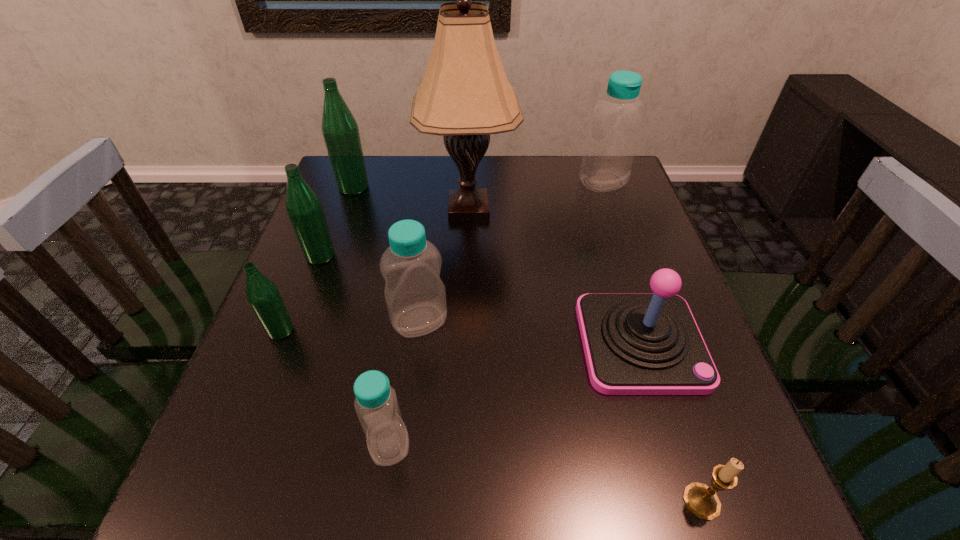
Locate an element on the screen. The height and width of the screenshot is (540, 960). vacant space positioned 0.060m on the right of the smallest green bottle is located at coordinates (324, 330).

Where is `vacant space situated on the left of the second nearest object`? vacant space situated on the left of the second nearest object is located at coordinates (282, 443).

You are a GUI agent. You are given a task and a screenshot of the screen. Output one action in this format:
    pyautogui.click(x=<x>, y=<y>)
    Task: Click on the free space located 0.400m on the back of the nearest object
    The height and width of the screenshot is (540, 960).
    Given the screenshot: What is the action you would take?
    pyautogui.click(x=632, y=293)

Where is `lamp located at the far edge`? This screenshot has width=960, height=540. lamp located at the far edge is located at coordinates (465, 96).

Image resolution: width=960 pixels, height=540 pixels. I want to click on bottle situated at the near edge, so click(376, 404).

You are a GUI agent. You are given a task and a screenshot of the screen. Output one action in this format:
    pyautogui.click(x=<x>, y=<y>)
    Task: Click on the candle holder at the near edge
    
    Given the screenshot: What is the action you would take?
    pyautogui.click(x=702, y=501)

At what (x,y) coordinates should I click in order to perform the action: click on bottle located at the right edge. Please return your answer as a coordinate pair (x, y). Looking at the image, I should click on (612, 140).

Where is `joystick present at the right edge`? This screenshot has width=960, height=540. joystick present at the right edge is located at coordinates (635, 343).

Identify the location of candle holder that is positioned at the right edge. The width and height of the screenshot is (960, 540). (702, 501).

Identify the location of object located at the far left corner. Image resolution: width=960 pixels, height=540 pixels. [340, 131].